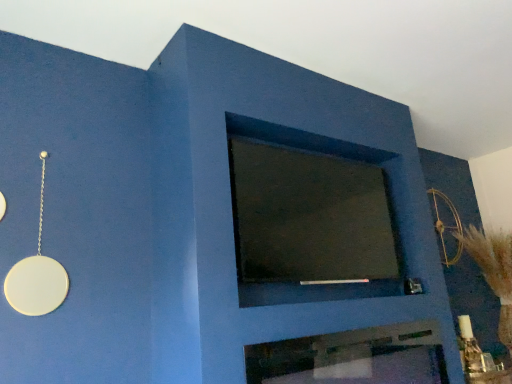
Question: Considering the positions of dark matte glass at center and metallic silver fireplace at center in the image, is dark matte glass at center taller or shorter than metallic silver fireplace at center?

Choices:
 (A) tall
 (B) short

Answer: (A)

Question: Would you say dark matte glass at center is to the left or to the right of metallic silver fireplace at center in the picture?

Choices:
 (A) left
 (B) right

Answer: (A)

Question: Which of these objects is positioned farthest from the dark matte glass at center?

Choices:
 (A) metallic silver fireplace at center
 (B) gold metallic bow at upper right

Answer: (B)

Question: Which of these objects is positioned farthest from the gold metallic bow at upper right?

Choices:
 (A) dark matte glass at center
 (B) metallic silver fireplace at center

Answer: (B)